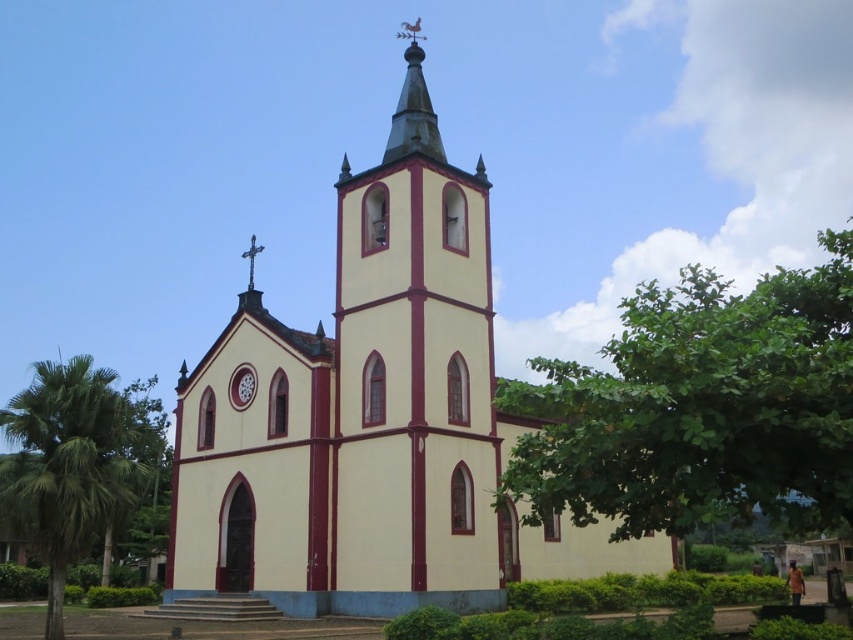
Question: Can you confirm if green leafy palm tree at lower left is positioned to the right of metallic cross at center?

Choices:
 (A) no
 (B) yes

Answer: (A)

Question: Which object appears farthest from the camera in this image?

Choices:
 (A) matte red clock at center
 (B) beige stucco church at center
 (C) metallic cross at center
 (D) green leafy palm tree at lower left

Answer: (C)

Question: Does matte red clock at center have a larger size compared to metallic cross at center?

Choices:
 (A) yes
 (B) no

Answer: (B)

Question: Which object is closer to the camera taking this photo?

Choices:
 (A) green leafy palm tree at lower left
 (B) matte red clock at center
 (C) metallic cross at center

Answer: (A)

Question: Which of the following is the closest to the observer?

Choices:
 (A) (67, 499)
 (B) (433, 118)
 (C) (492, 477)
 (D) (688, 440)

Answer: (D)

Question: Does beige stucco church at center have a lesser width compared to matte red clock at center?

Choices:
 (A) no
 (B) yes

Answer: (A)